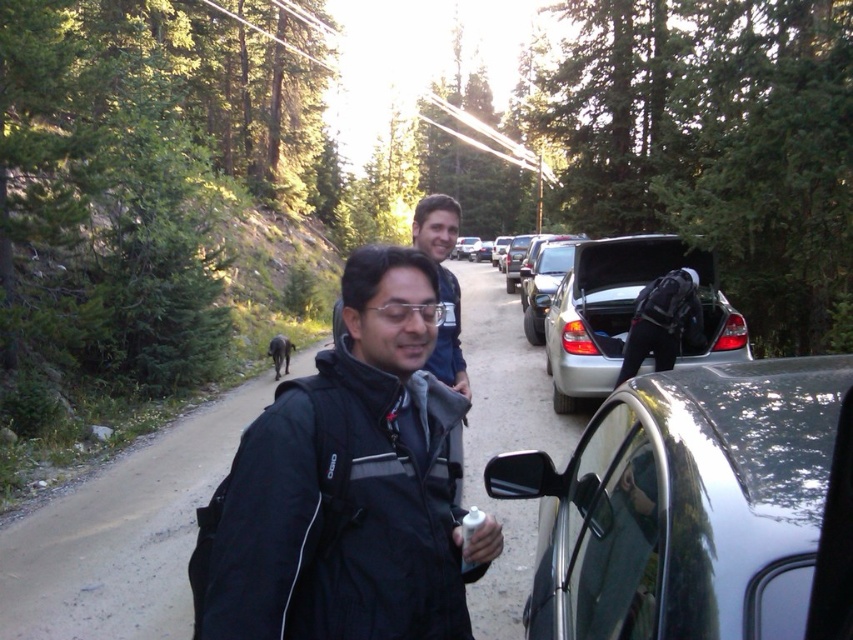
You are standing at the point with coordinates point (346, 486). What are you wearing?

The point (346, 486) corresponds to the black softshell jacket at center, so you are wearing a black softshell jacket at center.

You are a photographer trying to capture a group photo of the black softshell jacket at center and the matte blue shirt at center. If you want to ensure both subjects are in focus, which subject should you position closer to the camera?

The black softshell jacket at center has a smaller width than the matte blue shirt at center. To ensure both are in focus, position the black softshell jacket at center closer to the camera since smaller subjects require less depth of field to be in focus compared to larger ones.